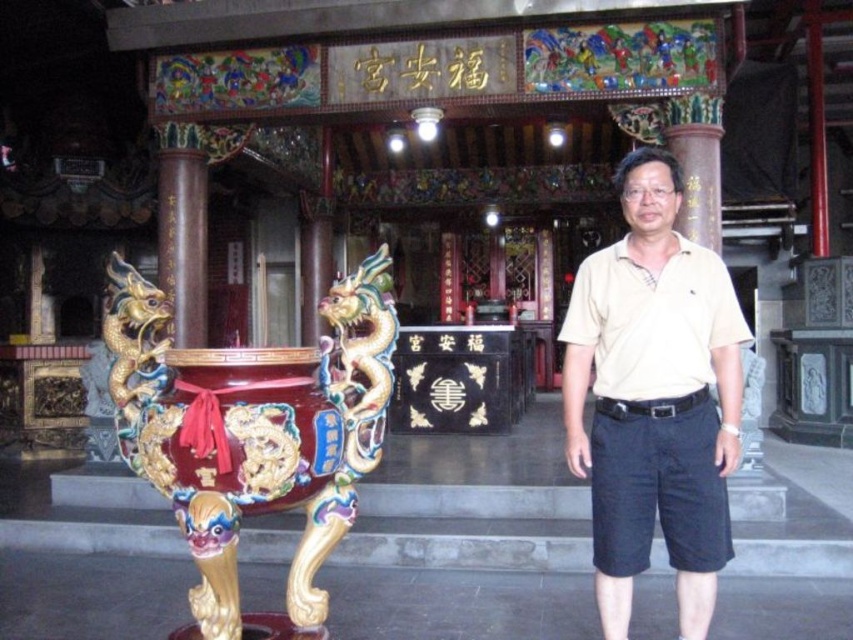
Between glossy ceramic incense burner at center and brown polished wood pillar at center, which one appears on the left side from the viewer's perspective?

brown polished wood pillar at center

Measure the distance between glossy ceramic incense burner at center and camera.

The distance of glossy ceramic incense burner at center from camera is 3.18 meters.

Is point (337, 460) less distant than point (184, 230)?

Yes, it is.

Locate an element on the screen. This screenshot has width=853, height=640. glossy ceramic incense burner at center is located at coordinates (253, 432).

Does glossy ceramic incense burner at center appear on the right side of beige cotton polo shirt at center?

No, glossy ceramic incense burner at center is not to the right of beige cotton polo shirt at center.

Who is more distant from viewer, (199, 532) or (665, 436)?

The point (665, 436) is more distant.

Is point (184, 520) farther from camera compared to point (711, 364)?

No, it is in front of (711, 364).

Where is `glossy ceramic incense burner at center`? glossy ceramic incense burner at center is located at coordinates (253, 432).

Is beige cotton polo shirt at center smaller than brown polished wood pillar at center?

No, beige cotton polo shirt at center is not smaller than brown polished wood pillar at center.

The height and width of the screenshot is (640, 853). What are the coordinates of `beige cotton polo shirt at center` in the screenshot? It's located at (654, 397).

Who is more distant from viewer, (599, 362) or (164, 285)?

The point (164, 285) is behind.

At what (x,y) coordinates should I click in order to perform the action: click on beige cotton polo shirt at center. Please return your answer as a coordinate pair (x, y). The height and width of the screenshot is (640, 853). Looking at the image, I should click on (654, 397).